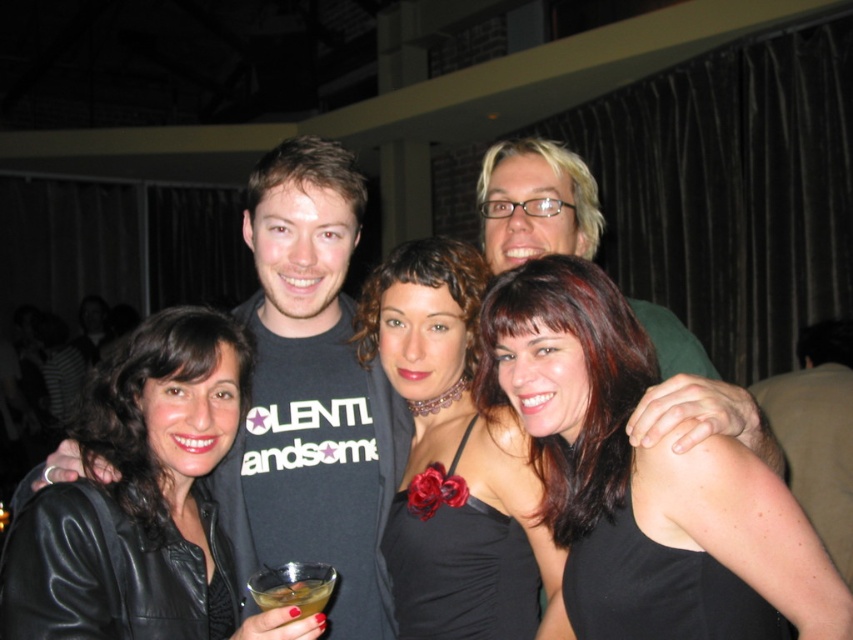
Measure the distance from shiny black dress at center to black satin dress at center.

shiny black dress at center and black satin dress at center are 9.82 inches apart from each other.

Is the position of shiny black dress at center more distant than that of black satin dress at center?

No, shiny black dress at center is closer to the viewer.

Where is `shiny black dress at center`? The height and width of the screenshot is (640, 853). shiny black dress at center is located at coordinates (643, 480).

Find the location of a particular element. The image size is (853, 640). black satin dress at center is located at coordinates point(451,458).

The width and height of the screenshot is (853, 640). What do you see at coordinates (451, 458) in the screenshot? I see `black satin dress at center` at bounding box center [451, 458].

Find the location of `black satin dress at center`. black satin dress at center is located at coordinates (451, 458).

Is leather jacket at left to the left of translucent glass drink at lower left from the viewer's perspective?

Yes, leather jacket at left is to the left of translucent glass drink at lower left.

Describe the element at coordinates (177, 467) in the screenshot. This screenshot has width=853, height=640. I see `leather jacket at left` at that location.

Which is behind, point (146, 372) or point (299, 604)?

The point (146, 372) is more distant.

This screenshot has height=640, width=853. What are the coordinates of `leather jacket at left` in the screenshot? It's located at (177, 467).